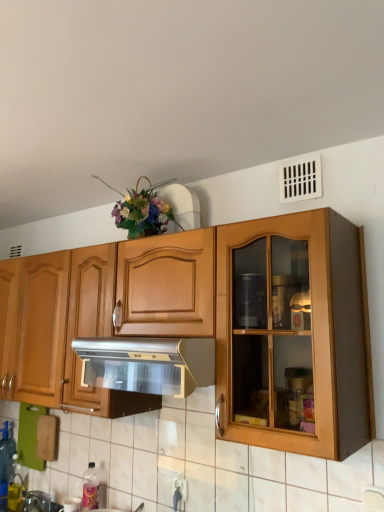
Question: Is pink plastic bottle at lower left, arranged as the 2th bottle when viewed from the back, completely or partially inside silver metallic range hood at center?

Choices:
 (A) no
 (B) yes

Answer: (A)

Question: Can you confirm if silver metallic range hood at center is smaller than pink plastic bottle at lower left, which ranks as the second bottle in left-to-right order?

Choices:
 (A) yes
 (B) no

Answer: (B)

Question: From a real-world perspective, is silver metallic range hood at center below pink plastic bottle at lower left, the 1th bottle viewed from the front?

Choices:
 (A) no
 (B) yes

Answer: (A)

Question: Can you confirm if silver metallic range hood at center is shorter than pink plastic bottle at lower left, which ranks as the second bottle in left-to-right order?

Choices:
 (A) yes
 (B) no

Answer: (A)

Question: Is the depth of silver metallic range hood at center greater than that of pink plastic bottle at lower left, which ranks as the second bottle in left-to-right order?

Choices:
 (A) no
 (B) yes

Answer: (A)

Question: In terms of size, does white plastic vent at upper right appear bigger or smaller than silver metallic range hood at center?

Choices:
 (A) big
 (B) small

Answer: (B)

Question: Is white plastic vent at upper right to the left or to the right of silver metallic range hood at center in the image?

Choices:
 (A) right
 (B) left

Answer: (A)

Question: Choose the correct answer: Is white plastic vent at upper right inside silver metallic range hood at center or outside it?

Choices:
 (A) outside
 (B) inside

Answer: (A)

Question: Is point (281, 170) positioned closer to the camera than point (195, 356)?

Choices:
 (A) closer
 (B) farther

Answer: (B)

Question: Which is correct: pink plastic bottle at lower left, which ranks as the second bottle in left-to-right order, is inside silver metallic range hood at center, or outside of it?

Choices:
 (A) outside
 (B) inside

Answer: (A)

Question: Is pink plastic bottle at lower left, arranged as the 2th bottle when viewed from the back, in front of or behind silver metallic range hood at center in the image?

Choices:
 (A) behind
 (B) front

Answer: (A)

Question: Visually, is pink plastic bottle at lower left, arranged as the 2th bottle when viewed from the back, positioned to the left or to the right of silver metallic range hood at center?

Choices:
 (A) left
 (B) right

Answer: (A)

Question: From their relative heights in the image, would you say pink plastic bottle at lower left, the 1th bottle viewed from the front, is taller or shorter than silver metallic range hood at center?

Choices:
 (A) short
 (B) tall

Answer: (B)

Question: Considering the positions of silver metallic range hood at center and white plastic vent at upper right in the image, is silver metallic range hood at center taller or shorter than white plastic vent at upper right?

Choices:
 (A) short
 (B) tall

Answer: (B)

Question: Is point (119, 342) positioned closer to the camera than point (283, 180)?

Choices:
 (A) closer
 (B) farther

Answer: (A)